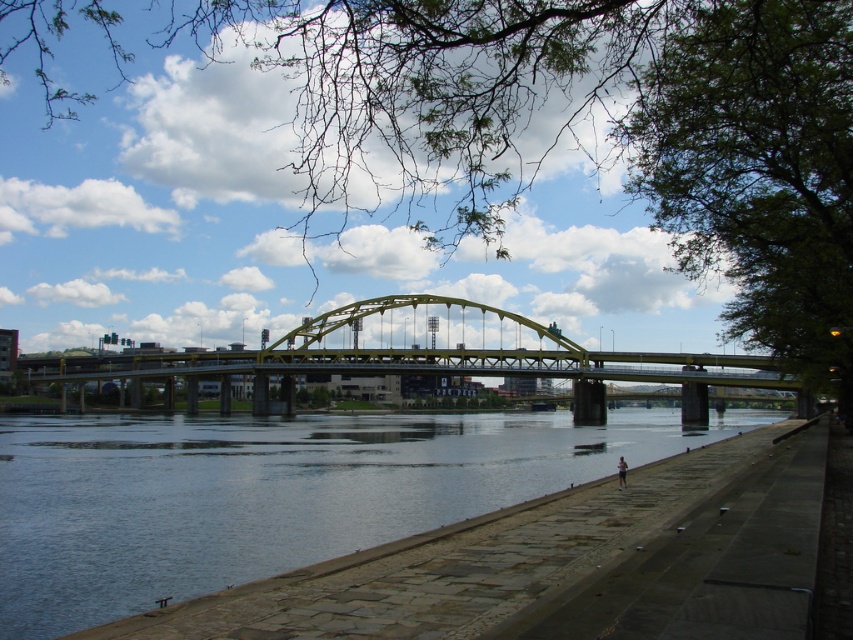
Question: Which point appears closest to the camera in this image?

Choices:
 (A) (308, 440)
 (B) (573, 360)

Answer: (B)

Question: Is clear water at lower left positioned in front of yellow metallic bridge at center?

Choices:
 (A) yes
 (B) no

Answer: (A)

Question: Is clear water at lower left positioned before yellow metallic bridge at center?

Choices:
 (A) yes
 (B) no

Answer: (A)

Question: Which of the following is the closest to the observer?

Choices:
 (A) yellow metallic bridge at center
 (B) clear water at lower left

Answer: (B)

Question: Can you confirm if clear water at lower left is bigger than yellow metallic bridge at center?

Choices:
 (A) yes
 (B) no

Answer: (B)